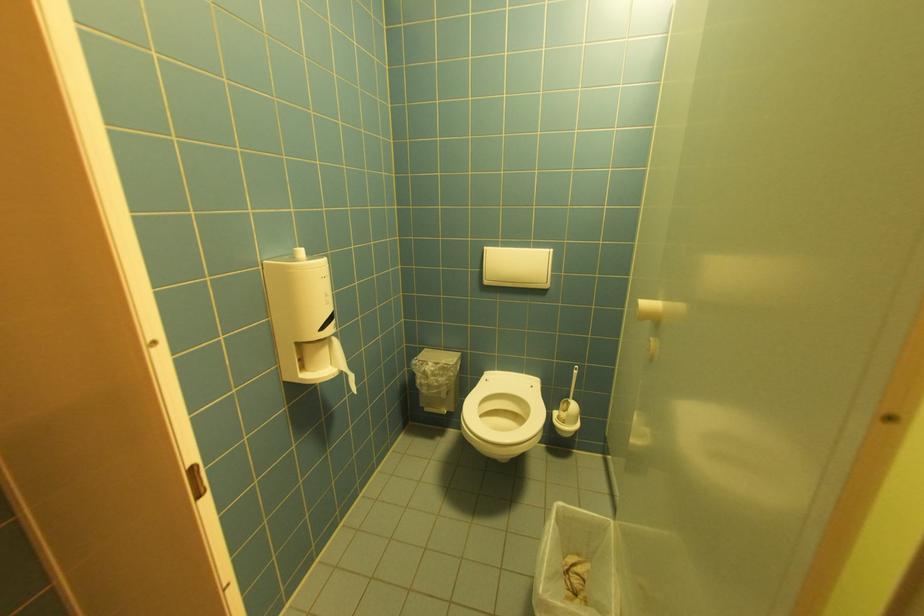
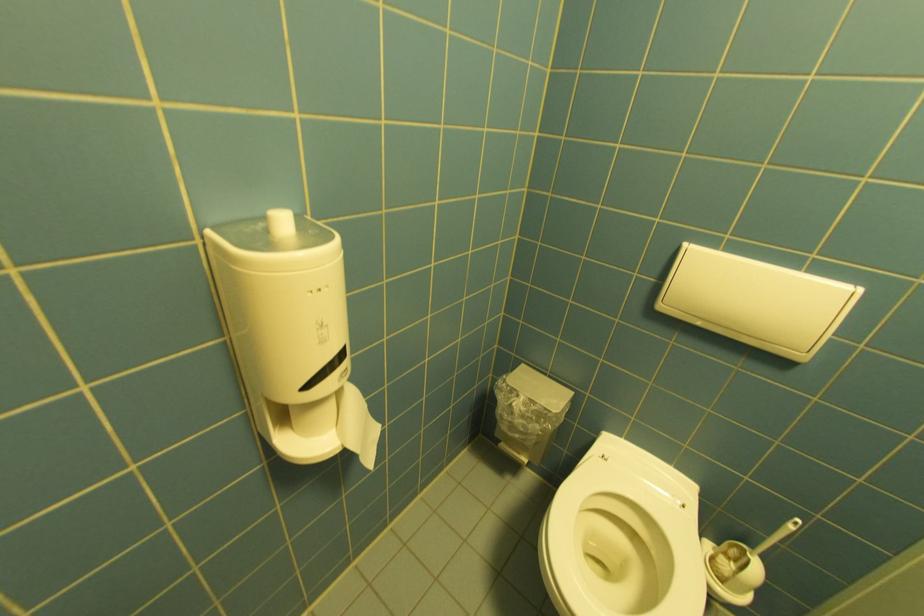
Question: Which direction would the cameraman need to move to produce the second image? Reply with the corresponding letter.

Choices:
 (A) Left
 (B) Right
 (C) Forward
 (D) Backward

Answer: (C)